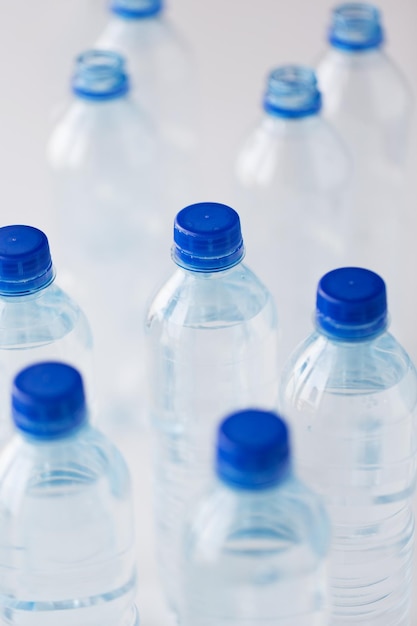
Locate an element on the screen. empty bottle is located at coordinates (101, 134), (133, 44), (355, 98), (296, 158).